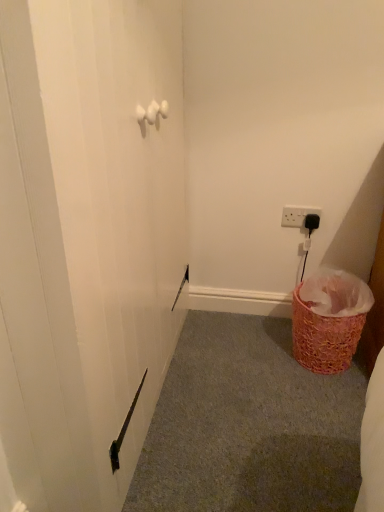
Question: Is pink woven basket at lower right surrounded by ruffled pink basket at lower right?

Choices:
 (A) yes
 (B) no

Answer: (B)

Question: Is ruffled pink basket at lower right at the left side of pink woven basket at lower right?

Choices:
 (A) no
 (B) yes

Answer: (A)

Question: From the image's perspective, is ruffled pink basket at lower right on top of pink woven basket at lower right?

Choices:
 (A) no
 (B) yes

Answer: (B)

Question: Considering the relative sizes of ruffled pink basket at lower right and pink woven basket at lower right in the image provided, is ruffled pink basket at lower right shorter than pink woven basket at lower right?

Choices:
 (A) no
 (B) yes

Answer: (A)

Question: Considering the relative sizes of ruffled pink basket at lower right and pink woven basket at lower right in the image provided, is ruffled pink basket at lower right smaller than pink woven basket at lower right?

Choices:
 (A) yes
 (B) no

Answer: (B)

Question: Is ruffled pink basket at lower right closer to the viewer compared to pink woven basket at lower right?

Choices:
 (A) yes
 (B) no

Answer: (B)

Question: From a real-world perspective, is white plastic electric outlet at upper right on pink woven basket at lower right?

Choices:
 (A) yes
 (B) no

Answer: (A)

Question: From the image's perspective, would you say white plastic electric outlet at upper right is shown under pink woven basket at lower right?

Choices:
 (A) no
 (B) yes

Answer: (A)

Question: Does white plastic electric outlet at upper right appear on the left side of pink woven basket at lower right?

Choices:
 (A) yes
 (B) no

Answer: (B)

Question: Is pink woven basket at lower right at the back of white plastic electric outlet at upper right?

Choices:
 (A) yes
 (B) no

Answer: (B)

Question: Is white plastic electric outlet at upper right taller than pink woven basket at lower right?

Choices:
 (A) no
 (B) yes

Answer: (B)

Question: From the image's perspective, is white plastic electric outlet at upper right above pink woven basket at lower right?

Choices:
 (A) no
 (B) yes

Answer: (B)

Question: Is white plastic electric outlet at upper right positioned before ruffled pink basket at lower right?

Choices:
 (A) yes
 (B) no

Answer: (B)